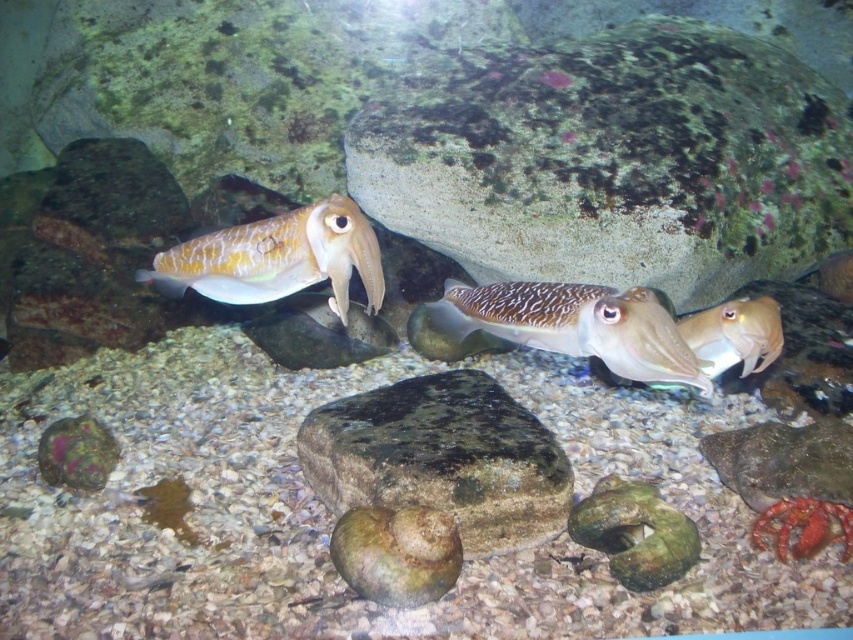
Is speckled skin squid at center thinner than shiny brown squid at center?

Indeed, speckled skin squid at center has a lesser width compared to shiny brown squid at center.

Can you confirm if speckled skin squid at center is positioned below shiny brown squid at center?

Yes.

Does point (706, 376) lie in front of point (253, 275)?

No, (706, 376) is further to viewer.

The height and width of the screenshot is (640, 853). In order to click on speckled skin squid at center in this screenshot , I will do `click(576, 324)`.

Between speckled skin squid at center and smooth brown squid at center, which one is positioned higher?

speckled skin squid at center is higher up.

Is speckled skin squid at center further to the viewer compared to smooth brown squid at center?

No, speckled skin squid at center is in front of smooth brown squid at center.

What are the coordinates of `speckled skin squid at center` in the screenshot? It's located at (576, 324).

Is speckled skin squid at center taller than smooth orange squid at lower right?

Correct, speckled skin squid at center is much taller as smooth orange squid at lower right.

This screenshot has height=640, width=853. Describe the element at coordinates (576, 324) in the screenshot. I see `speckled skin squid at center` at that location.

You are a GUI agent. You are given a task and a screenshot of the screen. Output one action in this format:
    pyautogui.click(x=<x>, y=<y>)
    Task: Click on the speckled skin squid at center
    The image size is (853, 640).
    Given the screenshot: What is the action you would take?
    pyautogui.click(x=576, y=324)